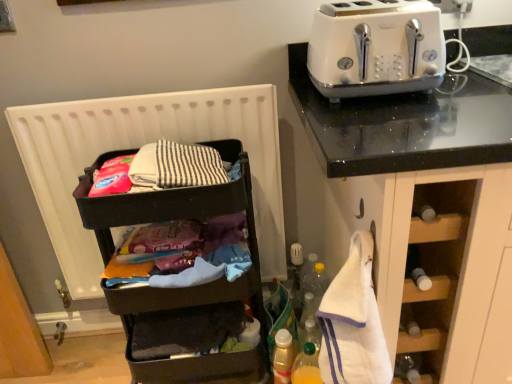
Measure the distance between point (282, 339) and camera.

Point (282, 339) is 4.33 feet away from camera.

What do you see at coordinates (170, 215) in the screenshot? I see `black plastic shelf at left` at bounding box center [170, 215].

What is the approximate height of translucent plastic bottle at lower center, the second bottle positioned from the left?

It is 26.92 centimeters.

In order to click on translucent plastic bottle at lower center, the second bottle from the right in this screenshot , I will do `click(283, 357)`.

Consider the image. Could you tell me if white terry cloth at right is facing translucent plastic bottle at lower center, the second bottle positioned from the left?

No, white terry cloth at right is not turned towards translucent plastic bottle at lower center, the second bottle positioned from the left.

Considering the relative positions of white terry cloth at right and translucent plastic bottle at lower center, the second bottle positioned from the left, in the image provided, is white terry cloth at right to the right of translucent plastic bottle at lower center, the second bottle positioned from the left, from the viewer's perspective?

Yes, white terry cloth at right is to the right of translucent plastic bottle at lower center, the second bottle positioned from the left.

Is point (330, 382) more distant than point (303, 356)?

No, (330, 382) is in front of (303, 356).

Is white terry cloth at right far away from white matte radiator at left?

They are positioned close to each other.

From the image's perspective, is white terry cloth at right above or below white matte radiator at left?

white terry cloth at right is situated lower than white matte radiator at left in the image.

Which point is more forward, (335,370) or (276,248)?

The point (335,370) is in front.

Where is `toaster that appears in front of the translucent plastic bottle at lower center, the first bottle from the right`? This screenshot has height=384, width=512. toaster that appears in front of the translucent plastic bottle at lower center, the first bottle from the right is located at coordinates (376, 48).

Does translucent plastic bottle at lower center, the second bottle positioned from the left, have a greater height compared to white glossy toaster at upper right?

Yes.

Do you think translucent plastic bottle at lower center, the first bottle from the right, is within white glossy toaster at upper right, or outside of it?

translucent plastic bottle at lower center, the first bottle from the right, is located beyond the bounds of white glossy toaster at upper right.

In terms of width, does translucent plastic bottle at lower center, the second bottle positioned from the left, look wider or thinner when compared to white glossy toaster at upper right?

Considering their sizes, translucent plastic bottle at lower center, the second bottle positioned from the left, looks slimmer than white glossy toaster at upper right.

Considering the sizes of objects translucent plastic bottle at lower center, placed as the 1th bottle when sorted from left to right, and white glossy toaster at upper right in the image provided, who is smaller, translucent plastic bottle at lower center, placed as the 1th bottle when sorted from left to right, or white glossy toaster at upper right?

With smaller size is translucent plastic bottle at lower center, placed as the 1th bottle when sorted from left to right.

From the image's perspective, relative to white glossy toaster at upper right, is translucent plastic bottle at lower center, placed as the 1th bottle when sorted from left to right, above or below?

translucent plastic bottle at lower center, placed as the 1th bottle when sorted from left to right, is below white glossy toaster at upper right.

Based on the photo, is translucent plastic bottle at lower center, placed as the 1th bottle when sorted from left to right, next to white glossy toaster at upper right and touching it?

No, translucent plastic bottle at lower center, placed as the 1th bottle when sorted from left to right, is not beside white glossy toaster at upper right.

From a real-world perspective, which is physically above, white glossy toaster at upper right or translucent plastic bottle at lower center, the second bottle positioned from the left?

white glossy toaster at upper right is physically above.

Which object is positioned more to the left, white glossy toaster at upper right or translucent plastic bottle at lower center, the second bottle positioned from the left?

translucent plastic bottle at lower center, the second bottle positioned from the left, is more to the left.

Considering the positions of points (364, 81) and (311, 344), is point (364, 81) farther from camera compared to point (311, 344)?

That is False.

Is white glossy toaster at upper right behind translucent plastic bottle at lower center, the first bottle from the right?

No, white glossy toaster at upper right is closer to the viewer.

Can you confirm if white terry cloth at right is bigger than white glossy toaster at upper right?

No, white terry cloth at right is not bigger than white glossy toaster at upper right.

Is white glossy toaster at upper right at the back of white terry cloth at right?

white terry cloth at right is not turned away from white glossy toaster at upper right.

From the image's perspective, is white terry cloth at right located above or below white glossy toaster at upper right?

Based on their image positions, white terry cloth at right is located beneath white glossy toaster at upper right.

Considering the sizes of white matte radiator at left and black plastic shelf at left in the image, is white matte radiator at left taller or shorter than black plastic shelf at left?

In the image, white matte radiator at left appears to be shorter than black plastic shelf at left.

From the image's perspective, which object appears higher, white matte radiator at left or black plastic shelf at left?

white matte radiator at left.

Looking at their sizes, would you say white matte radiator at left is wider or thinner than black plastic shelf at left?

In the image, white matte radiator at left appears to be more narrow than black plastic shelf at left.

This screenshot has height=384, width=512. Find the location of `radiator above the black plastic shelf at left (from a real-world perspective)`. radiator above the black plastic shelf at left (from a real-world perspective) is located at coordinates (139, 147).

You are a GUI agent. You are given a task and a screenshot of the screen. Output one action in this format:
    pyautogui.click(x=<x>, y=<y>)
    Task: Click on the 1st bottle to the left of the white terry cloth at right, starting your count from the anchor
    
    Given the screenshot: What is the action you would take?
    tap(306, 366)

This screenshot has width=512, height=384. I want to click on clothe that is under the white matte radiator at left (from a real-world perspective), so click(353, 322).

Estimate the real-world distances between objects in this image. Which object is further from white terry cloth at right, black plastic shelf at left or translucent plastic bottle at lower center, placed as the 1th bottle when sorted from left to right?

black plastic shelf at left lies further to white terry cloth at right than the other object.

Which object lies nearer to the anchor point white glossy toaster at upper right, translucent plastic bottle at lower center, placed as the 1th bottle when sorted from left to right, or black plastic shelf at left?

black plastic shelf at left is closer to white glossy toaster at upper right.

From the image, which object appears to be farther from translucent plastic bottle at lower center, the second bottle positioned from the left, white matte radiator at left or white glossy toaster at upper right?

The object further to translucent plastic bottle at lower center, the second bottle positioned from the left, is white glossy toaster at upper right.

From the image, which object appears to be farther from translucent plastic bottle at lower center, placed as the 1th bottle when sorted from left to right, white terry cloth at right or translucent plastic bottle at lower center, the first bottle from the right?

white terry cloth at right is positioned further to the anchor translucent plastic bottle at lower center, placed as the 1th bottle when sorted from left to right.

From the image, which object appears to be nearer to white matte radiator at left, translucent plastic bottle at lower center, the first bottle from the right, or black plastic shelf at left?

black plastic shelf at left.

Looking at the image, which one is located further to translucent plastic bottle at lower center, placed as the 1th bottle when sorted from left to right, translucent plastic bottle at lower center, the second bottle positioned from the left, or white matte radiator at left?

white matte radiator at left lies further to translucent plastic bottle at lower center, placed as the 1th bottle when sorted from left to right, than the other object.

Which object lies further to the anchor point white glossy toaster at upper right, translucent plastic bottle at lower center, the second bottle positioned from the left, or white matte radiator at left?

Based on the image, translucent plastic bottle at lower center, the second bottle positioned from the left, appears to be further to white glossy toaster at upper right.

Considering their positions, is white glossy toaster at upper right positioned further to white terry cloth at right than translucent plastic bottle at lower center, the second bottle from the right?

white glossy toaster at upper right is positioned further to the anchor white terry cloth at right.

Where is `shelf between white glossy toaster at upper right and translucent plastic bottle at lower center, the first bottle from the right, in the vertical direction`? This screenshot has width=512, height=384. shelf between white glossy toaster at upper right and translucent plastic bottle at lower center, the first bottle from the right, in the vertical direction is located at coordinates (170, 215).

You are a GUI agent. You are given a task and a screenshot of the screen. Output one action in this format:
    pyautogui.click(x=<x>, y=<y>)
    Task: Click on the bottle between white matte radiator at left and translucent plastic bottle at lower center, the second bottle positioned from the left, from top to bottom
    
    Given the screenshot: What is the action you would take?
    pyautogui.click(x=283, y=357)

Locate an element on the screen. This screenshot has height=384, width=512. shelf between white glossy toaster at upper right and white terry cloth at right vertically is located at coordinates coord(170,215).

This screenshot has height=384, width=512. I want to click on radiator between white glossy toaster at upper right and translucent plastic bottle at lower center, the second bottle positioned from the left, vertically, so click(x=139, y=147).